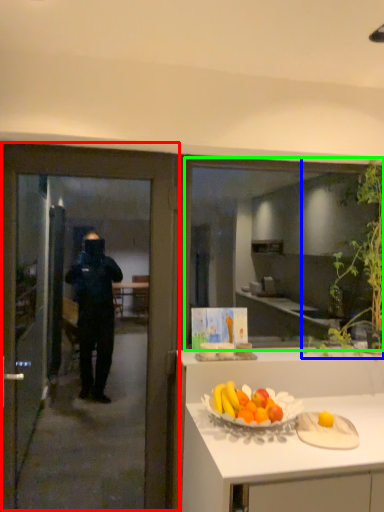
Question: Estimate the real-world distances between objects in this image. Which object is farther from door (highlighted by a red box), plant (highlighted by a blue box) or window (highlighted by a green box)?

Choices:
 (A) plant
 (B) window

Answer: (B)